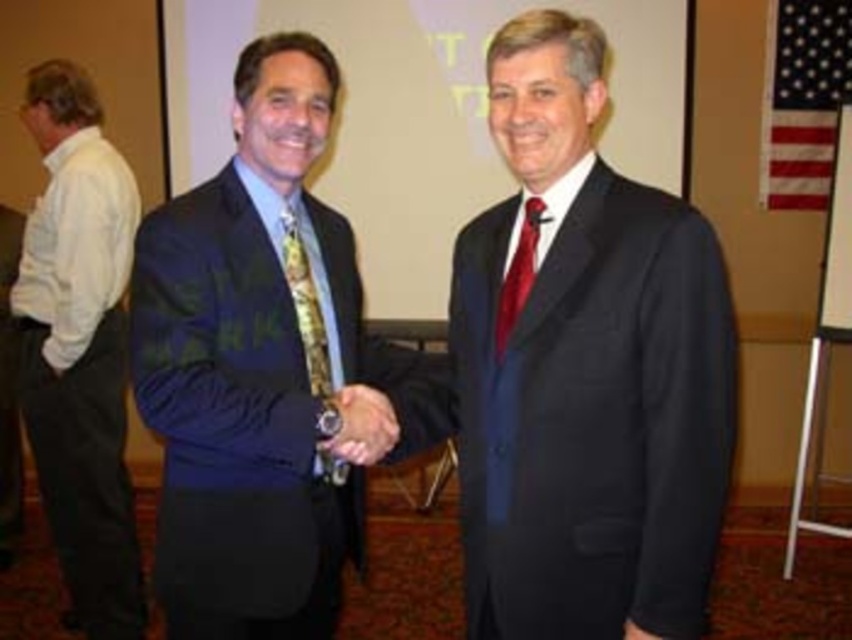
You are a photographer standing at the event. You want to take a photo of the shiny black suit at center from a distance of 2 meters. Can you step back to achieve this?

The shiny black suit at center is currently 1.44 meters away from the camera. To take the photo from 2 meters away, you need to step back an additional 0.56 meters.

You are a photographer at the event and want to capture a clear photo of the shiny black suit at center without the matte gold watch at center appearing in the background. Is this possible based on their positions?

The shiny black suit at center is in front of the matte gold watch at center, so yes, it is possible to capture a clear photo of the shiny black suit at center without the matte gold watch at center appearing in the background by focusing on the foreground.

You are standing in front of the image and want to know which of the two points, point (x=281, y=624) or point (x=309, y=280), is closer to you. Can you determine this based on their positions?

Point (x=309, y=280) is closer to you than point (x=281, y=624) because the description states that point (x=281, y=624) is further to the camera than point (x=309, y=280).